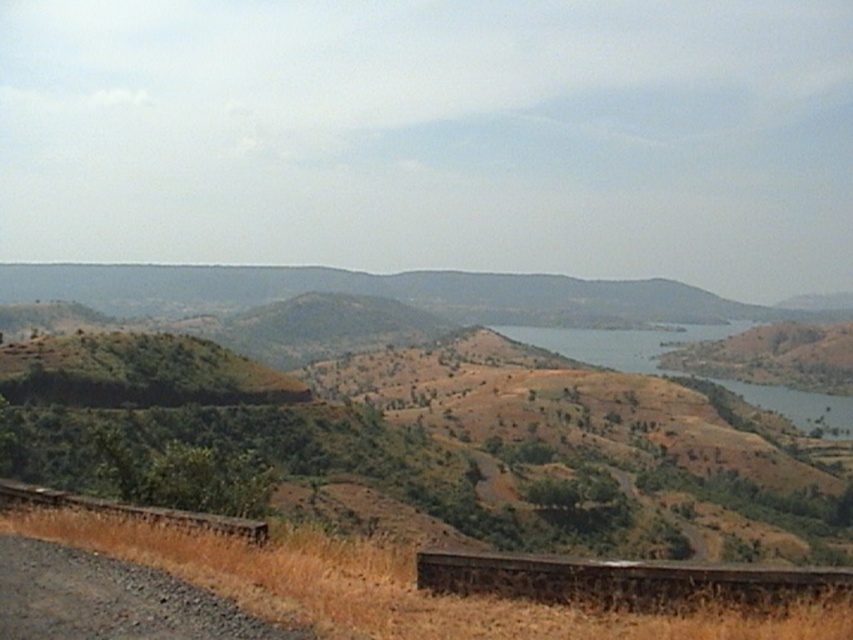
Can you confirm if brown concrete train track at lower center is positioned to the left of brown wooden train track at lower left?

Incorrect, brown concrete train track at lower center is not on the left side of brown wooden train track at lower left.

Does brown concrete train track at lower center have a larger size compared to brown wooden train track at lower left?

No.

The height and width of the screenshot is (640, 853). I want to click on brown concrete train track at lower center, so click(622, 580).

Can you confirm if brown gravel dirt track at lower left is positioned above brown dirt at lower center?

Yes, brown gravel dirt track at lower left is above brown dirt at lower center.

Consider the image. Who is more distant from viewer, (114, 572) or (788, 394)?

The point (788, 394) is behind.

Between point (28, 538) and point (558, 342), which one is positioned behind?

Point (558, 342)

Identify the location of brown gravel dirt track at lower left. (109, 600).

Can you confirm if brown gravel dirt track at lower left is positioned below brown wooden train track at lower left?

No, brown gravel dirt track at lower left is not below brown wooden train track at lower left.

Who is positioned more to the left, brown gravel dirt track at lower left or brown wooden train track at lower left?

From the viewer's perspective, brown wooden train track at lower left appears more on the left side.

Which is in front, point (106, 582) or point (259, 524)?

Point (106, 582)

Locate an element on the screen. brown gravel dirt track at lower left is located at coordinates (109, 600).